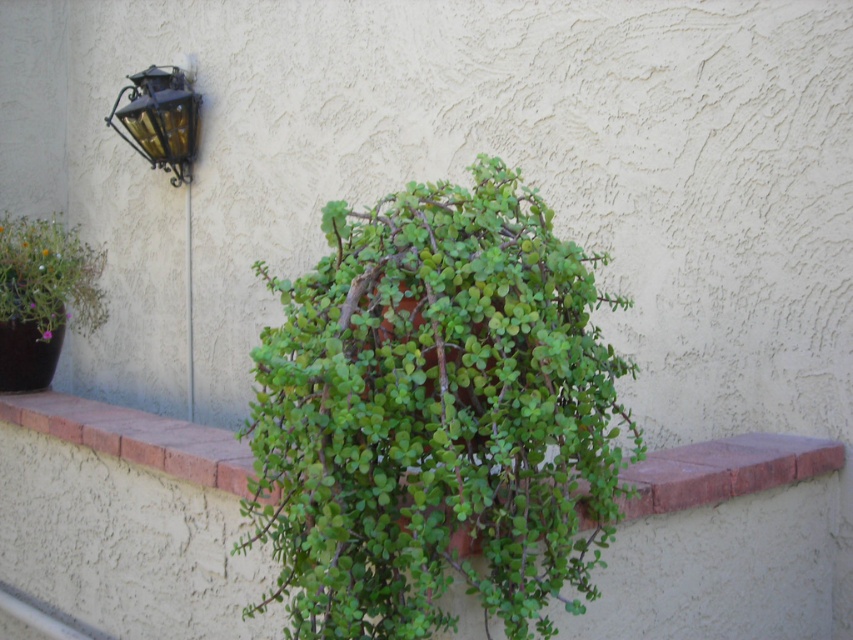
Which is more to the left, matte purple flower pot at left or gold textured lantern at upper left?

matte purple flower pot at left is more to the left.

From the picture: Does matte purple flower pot at left have a lesser width compared to gold textured lantern at upper left?

No.

Find the location of `matte purple flower pot at left`. matte purple flower pot at left is located at coordinates (49, 275).

Does green matte plant at center come behind matte purple flower pot at left?

No, green matte plant at center is in front of matte purple flower pot at left.

Which is behind, point (463, 280) or point (84, 326)?

Positioned behind is point (84, 326).

Does point (392, 241) lie in front of point (51, 301)?

Yes.

Locate an element on the screen. This screenshot has height=640, width=853. green matte plant at center is located at coordinates (434, 417).

Between green matte plant at center and gold textured lantern at upper left, which one appears on the left side from the viewer's perspective?

From the viewer's perspective, gold textured lantern at upper left appears more on the left side.

Is green matte plant at center shorter than gold textured lantern at upper left?

Incorrect, green matte plant at center's height does not fall short of gold textured lantern at upper left's.

Which is behind, point (358, 384) or point (128, 88)?

Positioned behind is point (128, 88).

Find the location of a particular element. The height and width of the screenshot is (640, 853). green matte plant at center is located at coordinates (434, 417).